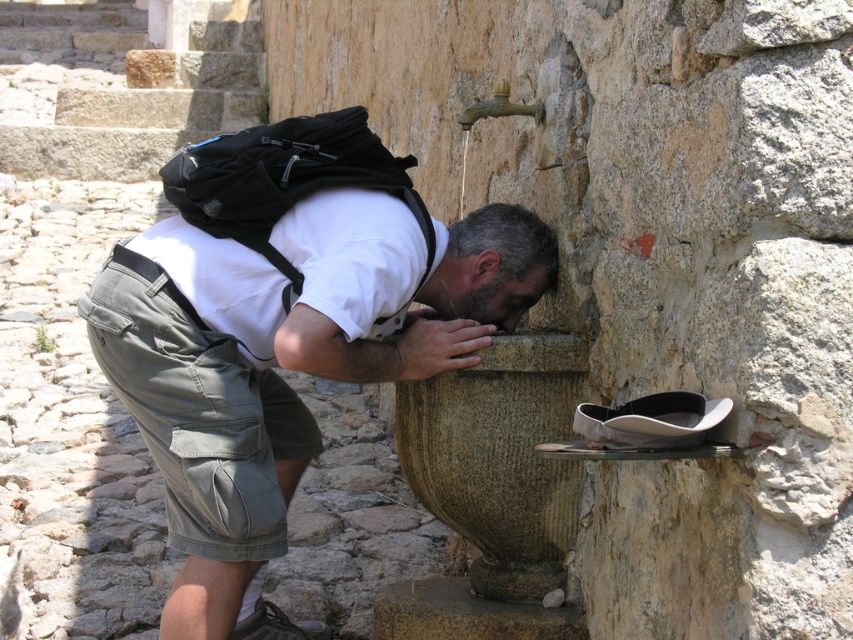
Question: Can you confirm if matte khaki shorts at lower left is positioned below black suede shoe at lower center?

Choices:
 (A) no
 (B) yes

Answer: (A)

Question: Which point is closer to the camera?

Choices:
 (A) black suede shoe at lower center
 (B) matte khaki shorts at lower left

Answer: (B)

Question: Which of the following is the farthest from the observer?

Choices:
 (A) matte khaki shorts at lower left
 (B) black suede shoe at lower center

Answer: (B)

Question: Is matte khaki shorts at lower left positioned at the back of black suede shoe at lower center?

Choices:
 (A) no
 (B) yes

Answer: (A)

Question: Can you confirm if matte khaki shorts at lower left is thinner than black suede shoe at lower center?

Choices:
 (A) no
 (B) yes

Answer: (A)